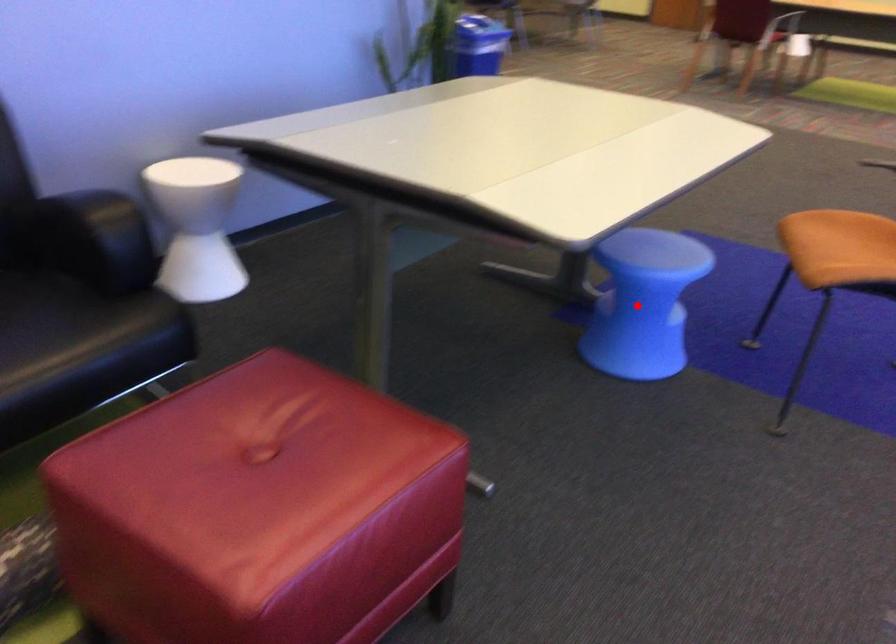
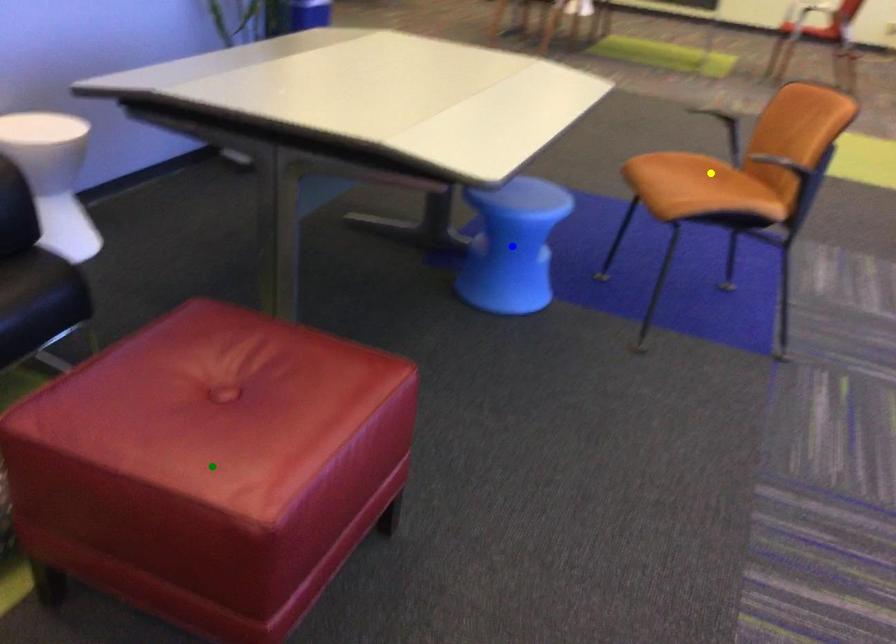
Question: I am providing you with two images of the same scene from different viewpoints. A red point is marked on the first image. You are given multiple points on the second image. Which spot in image 2 lines up with the point in image 1?

Choices:
 (A) blue point
 (B) yellow point
 (C) green point

Answer: (A)